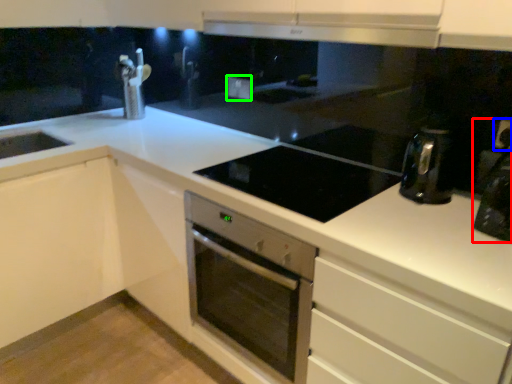
Question: Which object is positioned farthest from coffee machine (highlighted by a red box)? Select from electric outlet (highlighted by a blue box) and electric outlet (highlighted by a green box).

Choices:
 (A) electric outlet
 (B) electric outlet

Answer: (B)